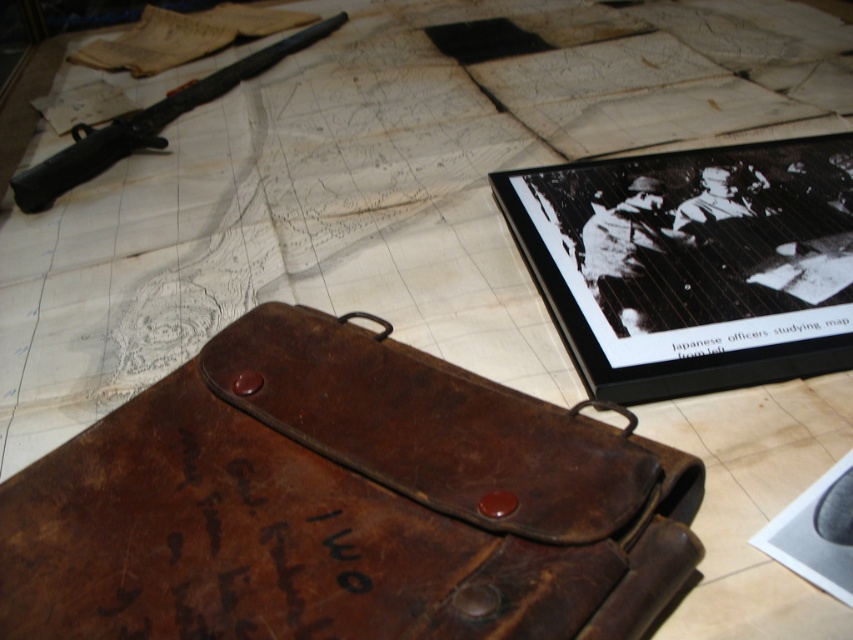
Question: Which point is farther from the camera taking this photo?

Choices:
 (A) (32, 202)
 (B) (672, 484)

Answer: (A)

Question: Is the position of leather case at center more distant than that of black matte rifle at upper left?

Choices:
 (A) yes
 (B) no

Answer: (B)

Question: Which of the following is the farthest from the observer?

Choices:
 (A) (120, 122)
 (B) (361, 486)

Answer: (A)

Question: Is leather case at center to the left of black matte rifle at upper left from the viewer's perspective?

Choices:
 (A) no
 (B) yes

Answer: (A)

Question: Is leather case at center above black matte rifle at upper left?

Choices:
 (A) no
 (B) yes

Answer: (A)